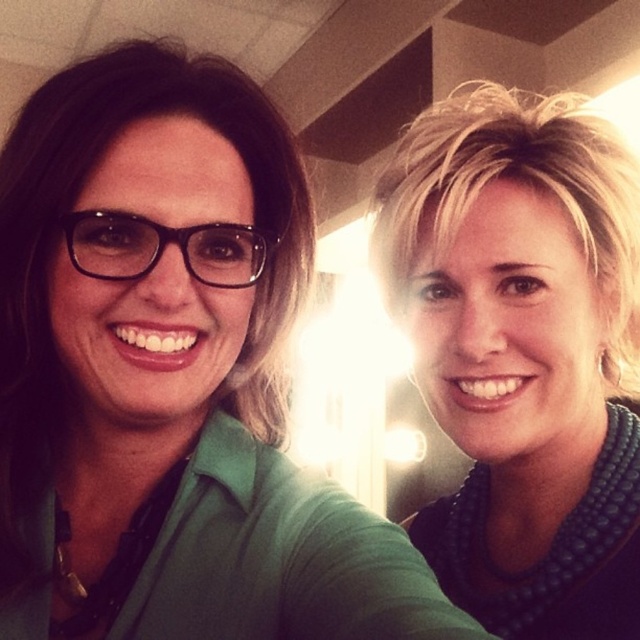
Is teal beaded necklace at upper right positioned before black plastic glasses at left?

That is False.

Locate an element on the screen. This screenshot has width=640, height=640. teal beaded necklace at upper right is located at coordinates (522, 355).